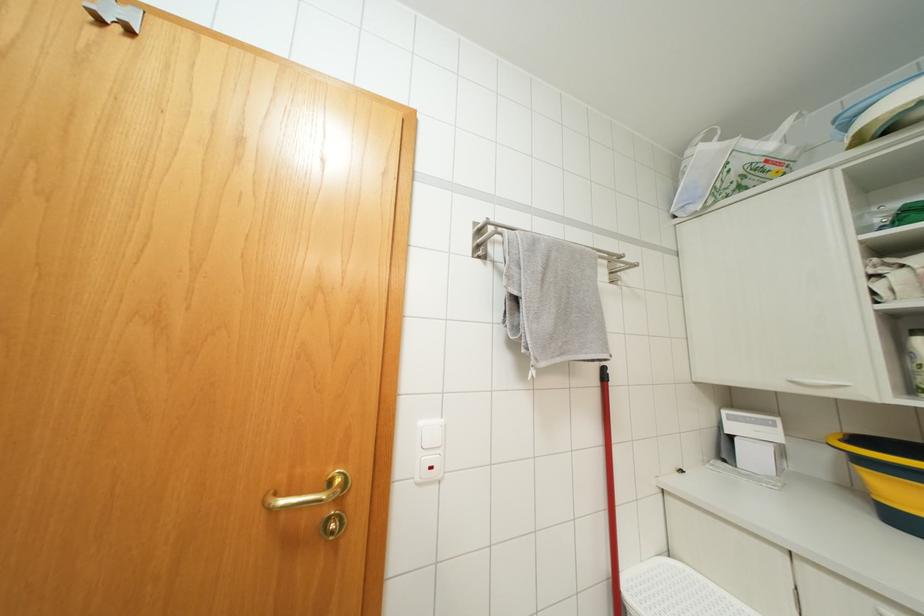
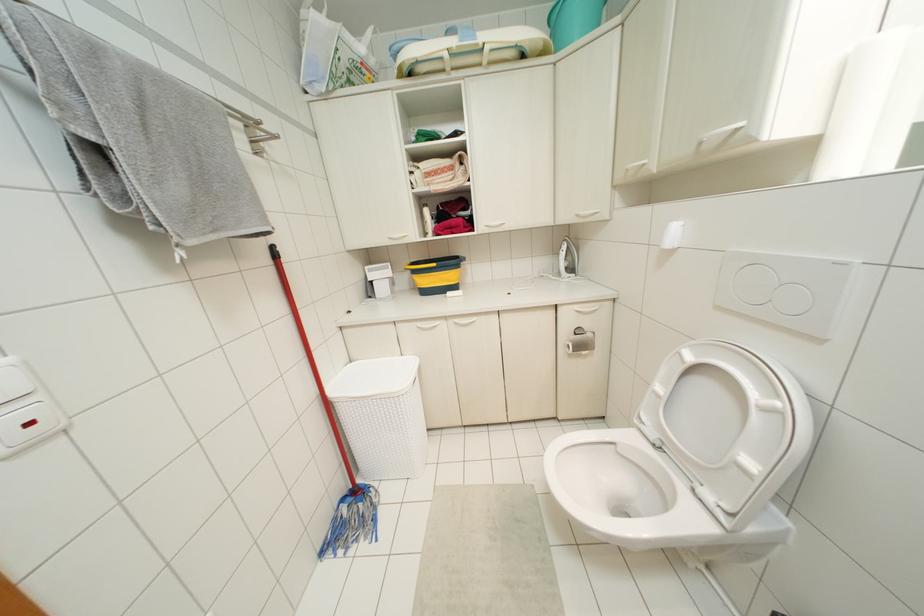
Question: I am providing you with two images of the same scene from different viewpoints. Please identify which objects are invisible in image2.

Choices:
 (A) red mop handle
 (B) toilet paper roll
 (C) iron handle
 (D) none of these

Answer: (D)